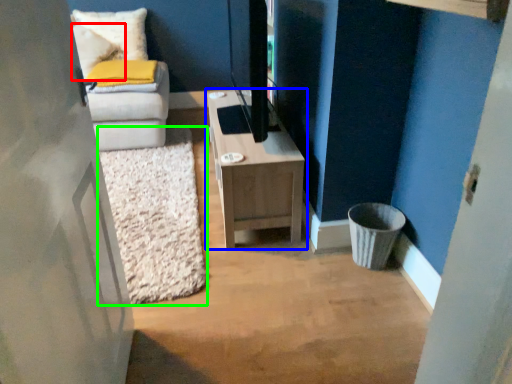
Question: Considering the real-world distances, which object is farthest from pillow (highlighted by a red box)? table (highlighted by a blue box) or mat (highlighted by a green box)?

Choices:
 (A) table
 (B) mat

Answer: (A)